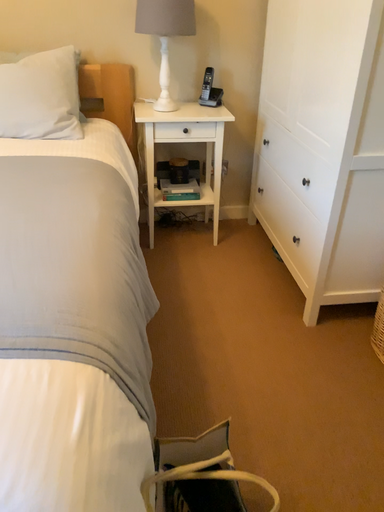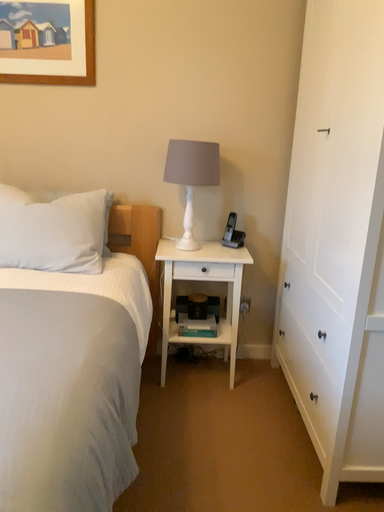
Question: How did the camera likely rotate when shooting the video?

Choices:
 (A) rotated downward
 (B) rotated upward

Answer: (B)